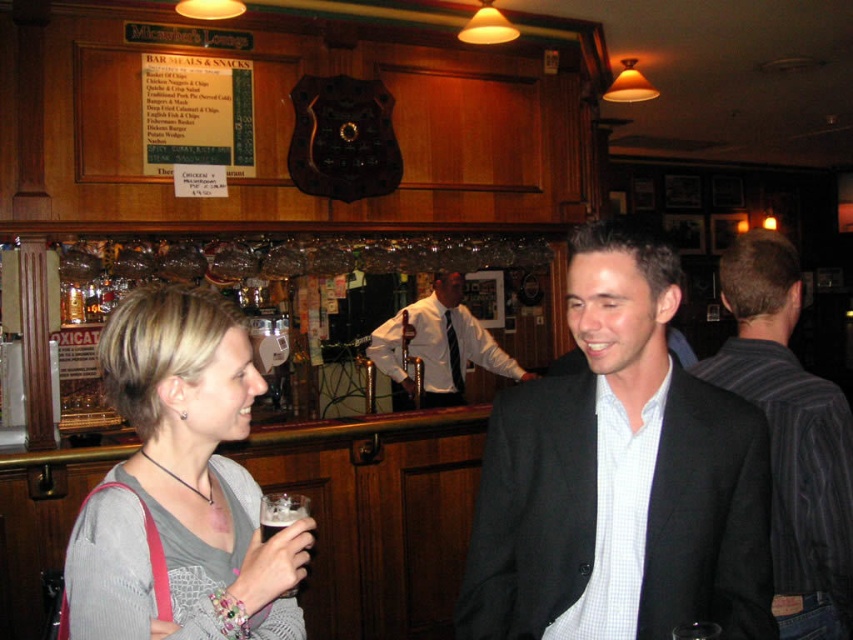
Question: Can you confirm if striped fabric shirt at right is smaller than brown frothy beer at lower left?

Choices:
 (A) yes
 (B) no

Answer: (B)

Question: Does black matte suit at center appear over white shirt at center?

Choices:
 (A) no
 (B) yes

Answer: (A)

Question: Among these objects, which one is farthest from the camera?

Choices:
 (A) brown frothy beer at lower left
 (B) gray knit sweater at center
 (C) gray sweater at center
 (D) white shirt at center

Answer: (D)

Question: Considering the real-world distances, which object is closest to the striped fabric shirt at right?

Choices:
 (A) gray knit sweater at center
 (B) gray sweater at center
 (C) white shirt at center
 (D) brown frothy beer at lower left

Answer: (A)

Question: In this image, where is striped fabric shirt at right located relative to white shirt at center?

Choices:
 (A) left
 (B) right

Answer: (B)

Question: Which object is farther from the camera taking this photo?

Choices:
 (A) black matte suit at center
 (B) gray knit sweater at center
 (C) white shirt at center
 (D) gray sweater at center

Answer: (C)